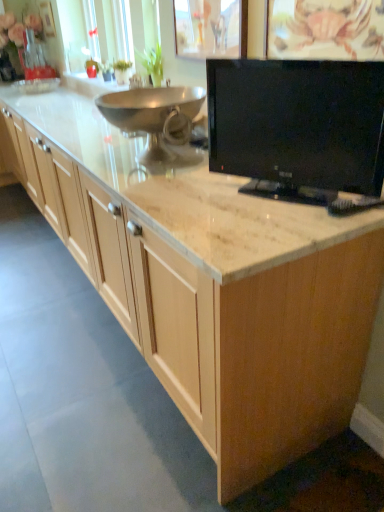
Question: Should I look upward or downward to see black glossy tv at upper right?

Choices:
 (A) up
 (B) down

Answer: (A)

Question: From the image's perspective, is polished stainless steel bowl at center on top of black glossy tv at upper right?

Choices:
 (A) yes
 (B) no

Answer: (A)

Question: Is polished stainless steel bowl at center positioned far away from black glossy tv at upper right?

Choices:
 (A) no
 (B) yes

Answer: (A)

Question: Is black glossy tv at upper right at the back of polished stainless steel bowl at center?

Choices:
 (A) no
 (B) yes

Answer: (A)

Question: Does polished stainless steel bowl at center appear on the left side of black glossy tv at upper right?

Choices:
 (A) no
 (B) yes

Answer: (B)

Question: From the image's perspective, is polished stainless steel bowl at center beneath black glossy tv at upper right?

Choices:
 (A) no
 (B) yes

Answer: (A)

Question: Considering the relative sizes of polished stainless steel bowl at center and black glossy tv at upper right in the image provided, is polished stainless steel bowl at center wider than black glossy tv at upper right?

Choices:
 (A) yes
 (B) no

Answer: (A)

Question: Is polished stainless steel bowl at center inside satin nickel faucet at upper center?

Choices:
 (A) yes
 (B) no

Answer: (B)

Question: Does satin nickel faucet at upper center have a greater width compared to polished stainless steel bowl at center?

Choices:
 (A) no
 (B) yes

Answer: (A)

Question: Is satin nickel faucet at upper center smaller than polished stainless steel bowl at center?

Choices:
 (A) no
 (B) yes

Answer: (B)

Question: From the image's perspective, does satin nickel faucet at upper center appear lower than polished stainless steel bowl at center?

Choices:
 (A) no
 (B) yes

Answer: (A)

Question: Is satin nickel faucet at upper center facing away from polished stainless steel bowl at center?

Choices:
 (A) no
 (B) yes

Answer: (A)

Question: From a real-world perspective, does satin nickel faucet at upper center sit lower than polished stainless steel bowl at center?

Choices:
 (A) yes
 (B) no

Answer: (B)

Question: Can we say satin nickel faucet at upper center lies outside black glossy tv at upper right?

Choices:
 (A) yes
 (B) no

Answer: (A)